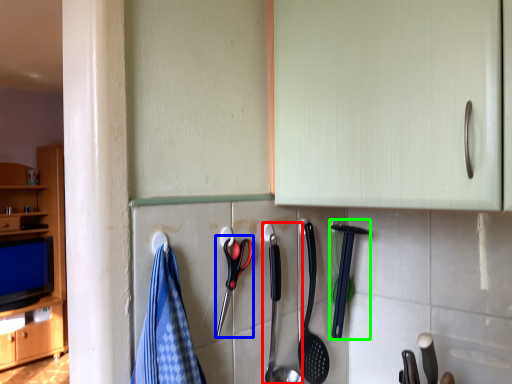
Question: Estimate the real-world distances between objects in this image. Which object is closer to silverware (highlighted by a red box), scissors (highlighted by a blue box) or silverware (highlighted by a green box)?

Choices:
 (A) scissors
 (B) silverware

Answer: (A)